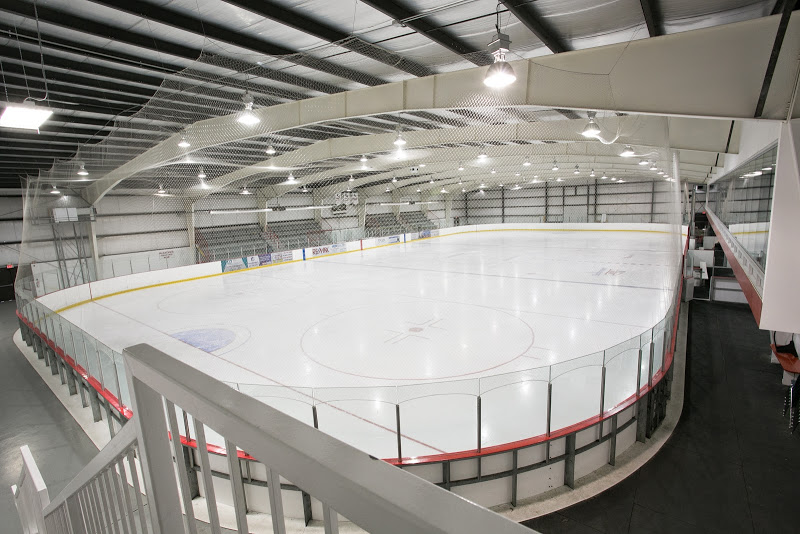
At what (x,y) coordinates should I click in order to perform the action: click on air conditioning venting. Please return your answer as a coordinate pair (x, y). This screenshot has width=800, height=534. Looking at the image, I should click on (669, 93).